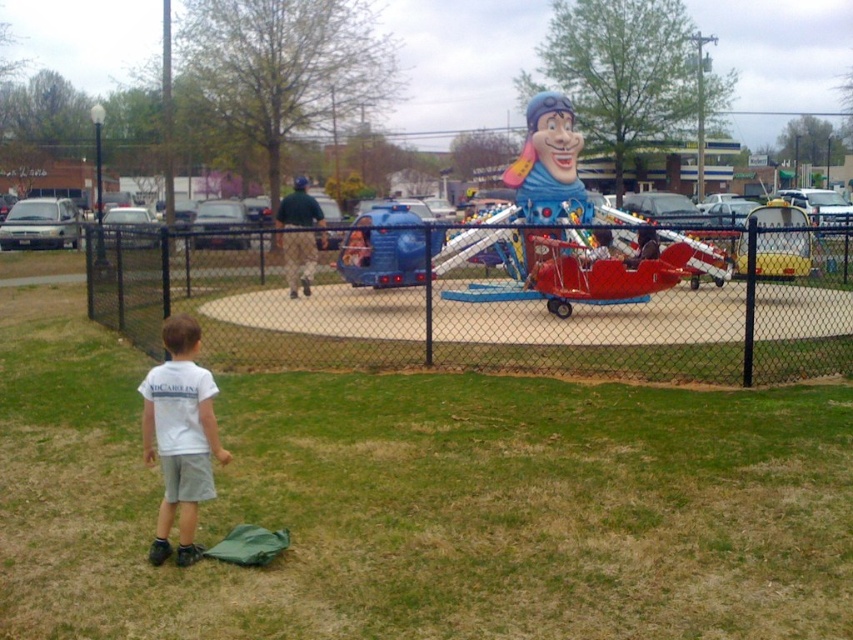
Who is lower down, red plastic airplane at center or white cotton shirt at lower left?

white cotton shirt at lower left is below.

Who is more forward, (509, 209) or (166, 444)?

Point (166, 444) is in front.

In order to click on red plastic airplane at center in this screenshot , I will do `click(550, 170)`.

Between black chain-link fence at center and white cotton shirt at lower left, which one appears on the right side from the viewer's perspective?

black chain-link fence at center

Who is higher up, black chain-link fence at center or white cotton shirt at lower left?

black chain-link fence at center

Who is more forward, (280,316) or (180,330)?

Point (180,330) is more forward.

Where is `black chain-link fence at center`? black chain-link fence at center is located at coordinates (477, 317).

Does black chain-link fence at center appear on the left side of red plastic airplane at center?

Yes, black chain-link fence at center is to the left of red plastic airplane at center.

Between black chain-link fence at center and red plastic airplane at center, which one appears on the left side from the viewer's perspective?

Positioned to the left is black chain-link fence at center.

Which is in front, point (822, 300) or point (663, 280)?

Point (663, 280) is in front.

Image resolution: width=853 pixels, height=640 pixels. Identify the location of black chain-link fence at center. (477, 317).